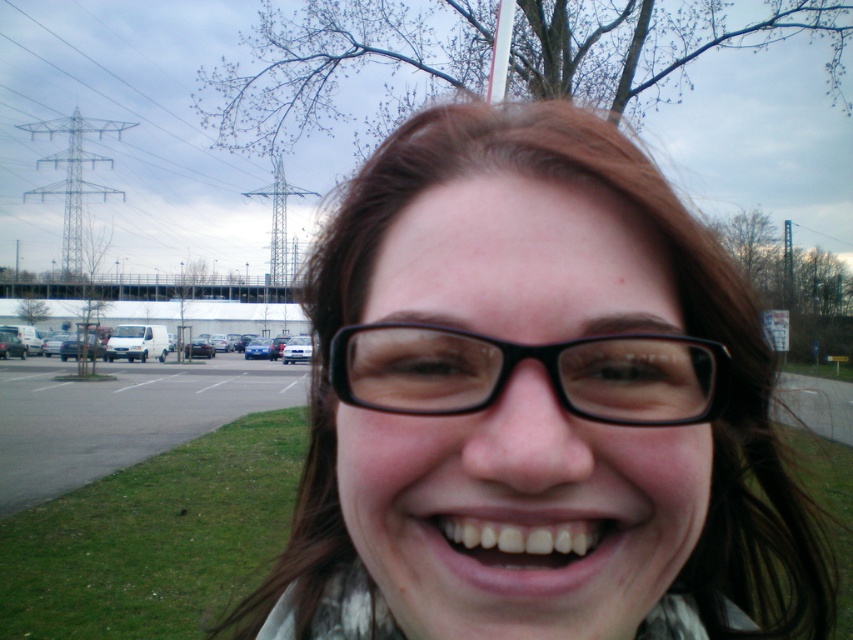
Based on the photo, you are a photographer taking a portrait of someone with black plastic glasses at center and white glossy teeth at center. Which object is located to the right of the other?

The black plastic glasses at center is positioned on the right side of white glossy teeth at center.